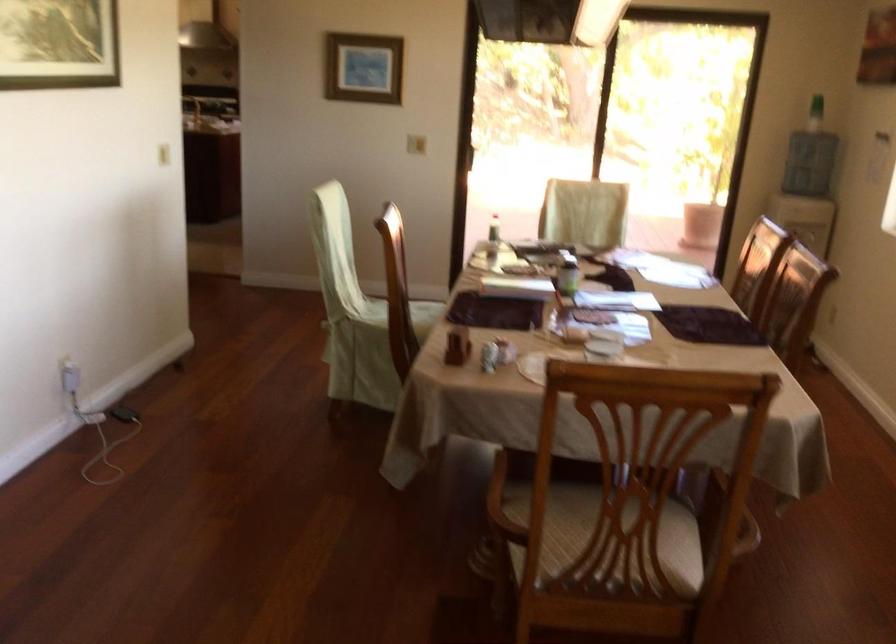
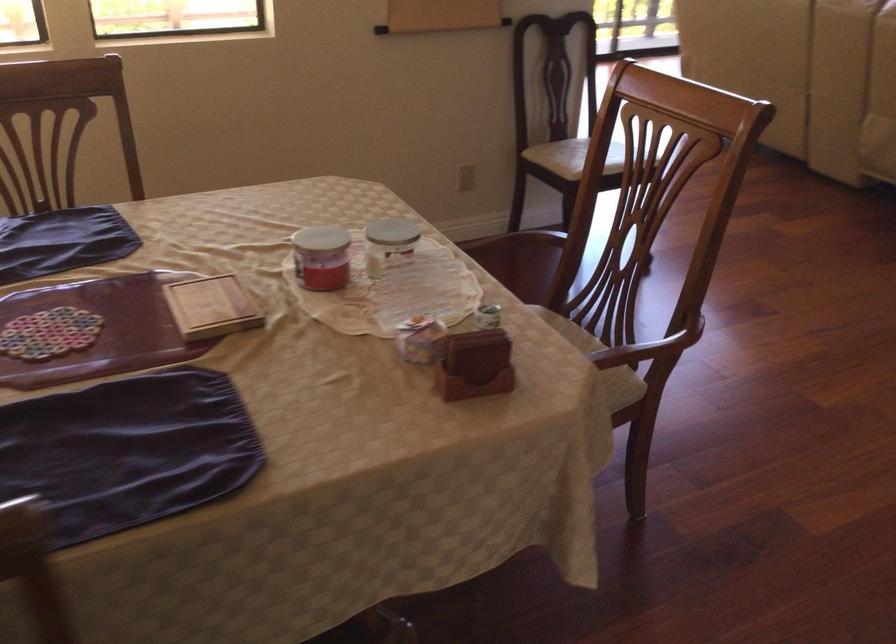
Locate, in the second image, the point that corresponds to point 630,564 in the first image.

(564, 322)